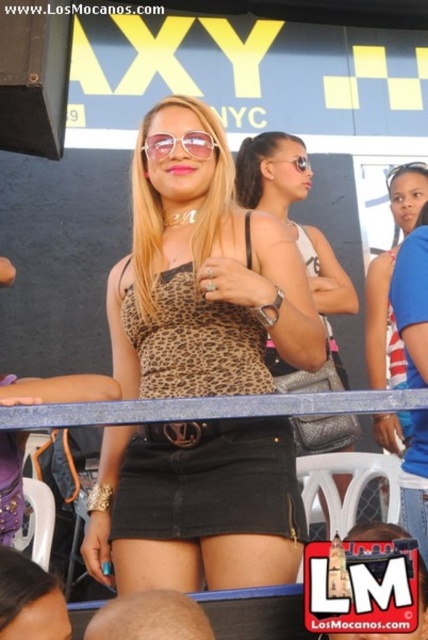
Question: Is the position of matte black skirt at center more distant than that of pink acetate sunglasses at center?

Choices:
 (A) no
 (B) yes

Answer: (A)

Question: Is leopard print top at center wider than pink acetate sunglasses at center?

Choices:
 (A) yes
 (B) no

Answer: (A)

Question: Is dark brown hair at center in front of matte black skirt at center?

Choices:
 (A) yes
 (B) no

Answer: (A)

Question: Which point is farther to the camera?

Choices:
 (A) black denim skirt at center
 (B) pink acetate sunglasses at center
 (C) matte black skirt at center
 (D) dark brown hair at center

Answer: (B)

Question: Which object appears closest to the camera in this image?

Choices:
 (A) black denim skirt at center
 (B) dark brown hair at center
 (C) smooth brown skin at lower center
 (D) clear plastic goggles at center

Answer: (B)

Question: Which object is the farthest from the leopard print top at center?

Choices:
 (A) matte black skirt at center
 (B) smooth brown skin at lower center

Answer: (A)